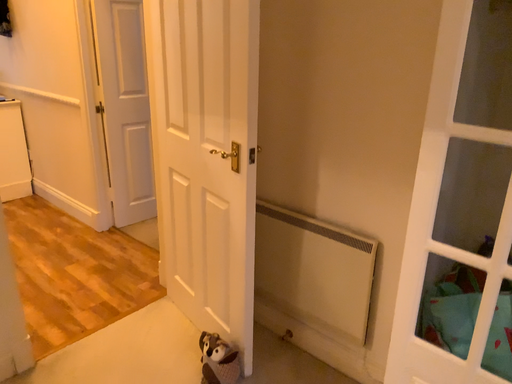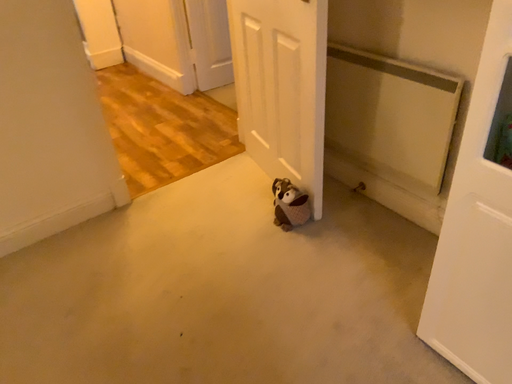
Question: How did the camera likely rotate when shooting the video?

Choices:
 (A) rotated left
 (B) rotated right

Answer: (A)